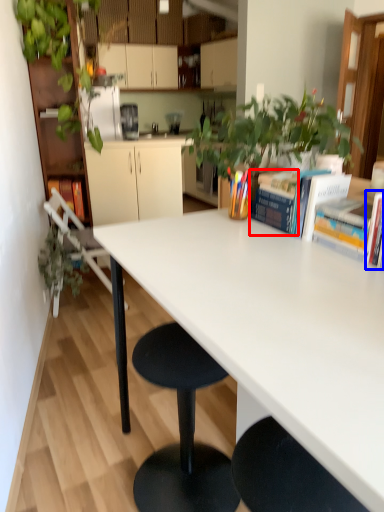
Question: Which of the following is the closest to the observer, book (highlighted by a red box) or book (highlighted by a blue box)?

Choices:
 (A) book
 (B) book

Answer: (B)